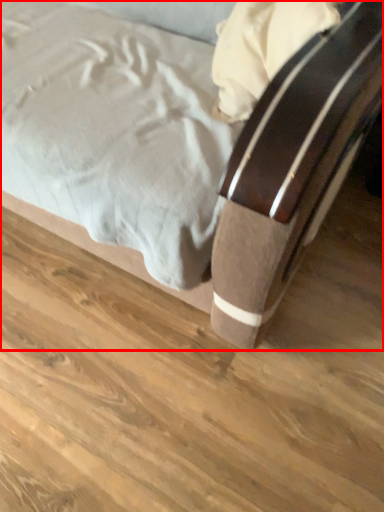
Question: In this image, where is bed (annotated by the red box) located relative to plank?

Choices:
 (A) right
 (B) left

Answer: (B)